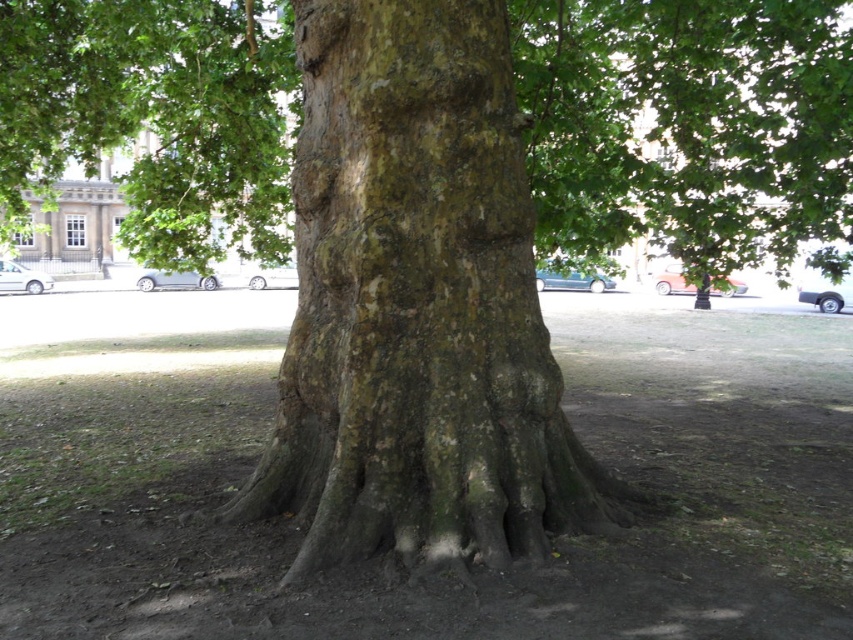
You are a botanist examining the tree trunk in the image. You notice two distinct areas of bark at the center. Which of the two, the green mossy bark at center or the smooth bark tree at center, has a larger surface area?

The smooth bark tree at center has a larger surface area than the green mossy bark at center because the green mossy bark at center is smaller than smooth bark tree at center.

You are a botanist examining the tree trunk in the image. You notice two distinct bark areas labeled as green mossy bark at center and smooth bark tree at center. Which of these two areas is shorter in height?

The green mossy bark at center is shorter in height compared to the smooth bark tree at center.

Based on the photo, you are a botanist examining the tree trunk in the image. You notice two distinct bark areas labeled as green mossy bark at center and smooth bark tree at center. Which of these two areas is located lower on the tree trunk?

The green mossy bark at center is positioned under the smooth bark tree at center, so it is located lower on the tree trunk.